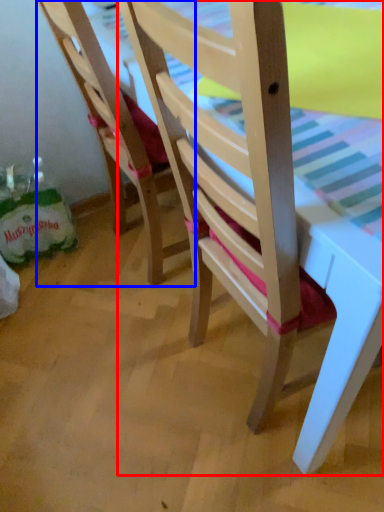
Question: Which point is closer to the camera, chair (highlighted by a red box) or chair (highlighted by a blue box)?

Choices:
 (A) chair
 (B) chair

Answer: (A)